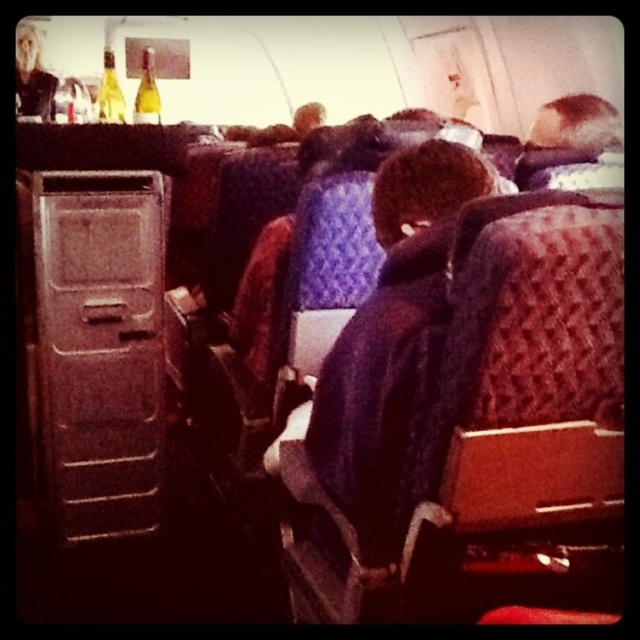
Question: Is the position of metallic gray drawer at left less distant than that of matte yellow glass bottle at upper left?

Choices:
 (A) yes
 (B) no

Answer: (A)

Question: Is metallic gray drawer at left positioned in front of smooth brown hair at upper right?

Choices:
 (A) no
 (B) yes

Answer: (B)

Question: Can you confirm if metallic gray drawer at left is positioned to the right of green glass bottle at upper left?

Choices:
 (A) no
 (B) yes

Answer: (B)

Question: Which object is farther from the camera taking this photo?

Choices:
 (A) matte yellow glass bottle at upper left
 (B) metallic gray drawer at left

Answer: (A)

Question: Which object is farther from the camera taking this photo?

Choices:
 (A) matte yellow glass bottle at upper left
 (B) smooth brown hair at upper right
 (C) green glass bottle at upper left
 (D) metallic gray drawer at left

Answer: (C)

Question: Which point is farther to the camera?

Choices:
 (A) (104, 83)
 (B) (570, 102)
 (C) (140, 102)
 (D) (44, 257)

Answer: (A)